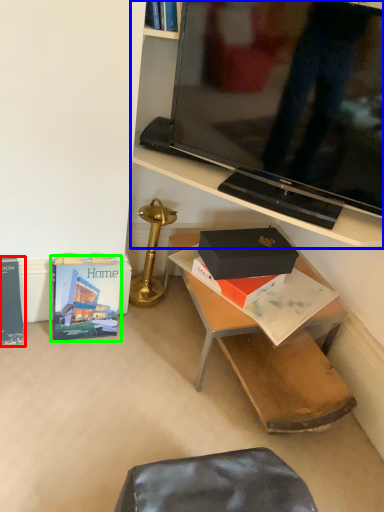
Question: Considering the real-world distances, which object is farthest from paperback book (highlighted by a red box)? shelf (highlighted by a blue box) or paperback book (highlighted by a green box)?

Choices:
 (A) shelf
 (B) paperback book

Answer: (A)